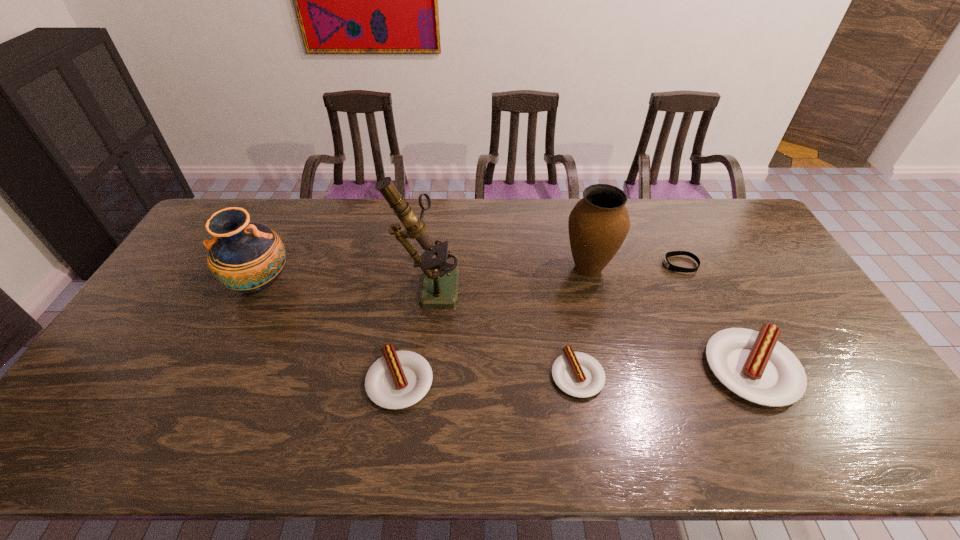
The image size is (960, 540). I want to click on free point that keeps the sausages evenly spaced on the left, so click(219, 387).